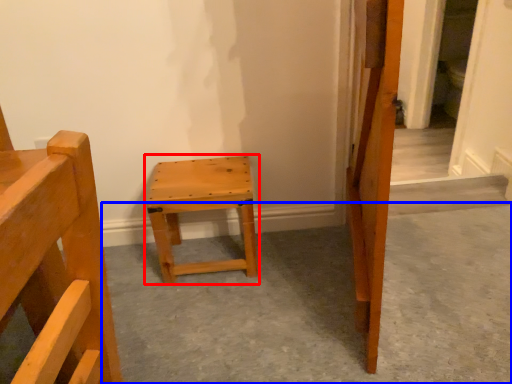
Question: Which point is further to the camera, stool (highlighted by a red box) or concrete (highlighted by a blue box)?

Choices:
 (A) stool
 (B) concrete

Answer: (A)